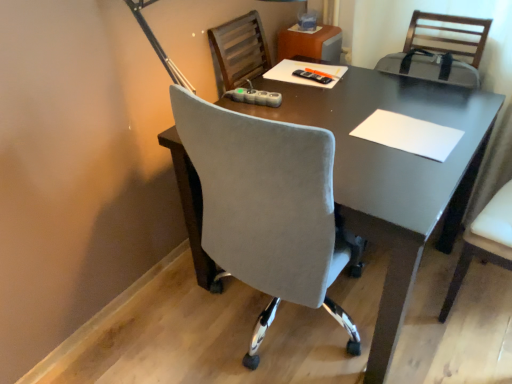
At what (x,y) coordinates should I click in order to perform the action: click on free space to the left of white leather chair at right. Please return your answer as a coordinate pair (x, y). The width and height of the screenshot is (512, 384). Looking at the image, I should click on (428, 317).